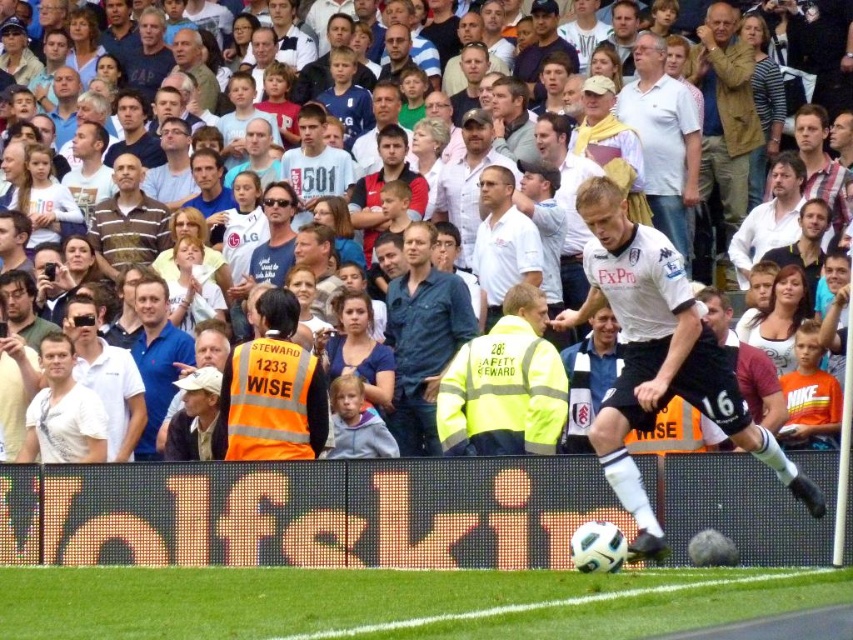
This screenshot has height=640, width=853. What do you see at coordinates (503, 241) in the screenshot?
I see `white shirt at center` at bounding box center [503, 241].

Who is lower down, white shirt at center or striped cotton shirt at center?

white shirt at center

Does point (509, 232) lie behind point (148, 221)?

No, (509, 232) is in front of (148, 221).

The image size is (853, 640). In order to click on white shirt at center in this screenshot , I will do `click(503, 241)`.

Which of these two, yellow reflective jacket at center or white cotton shirt at upper center, stands shorter?

yellow reflective jacket at center is shorter.

Who is taller, yellow reflective jacket at center or white cotton shirt at upper center?

white cotton shirt at upper center

Identify the location of yellow reflective jacket at center. (503, 387).

Identify the location of blue cotton shirt at center. (422, 339).

Is point (410, 284) positioned behind point (480, 259)?

No, it is in front of (480, 259).

Does point (405, 440) come farther from viewer compared to point (508, 176)?

No, (405, 440) is closer to viewer.

This screenshot has height=640, width=853. Find the location of `blue cotton shirt at center`. blue cotton shirt at center is located at coordinates (422, 339).